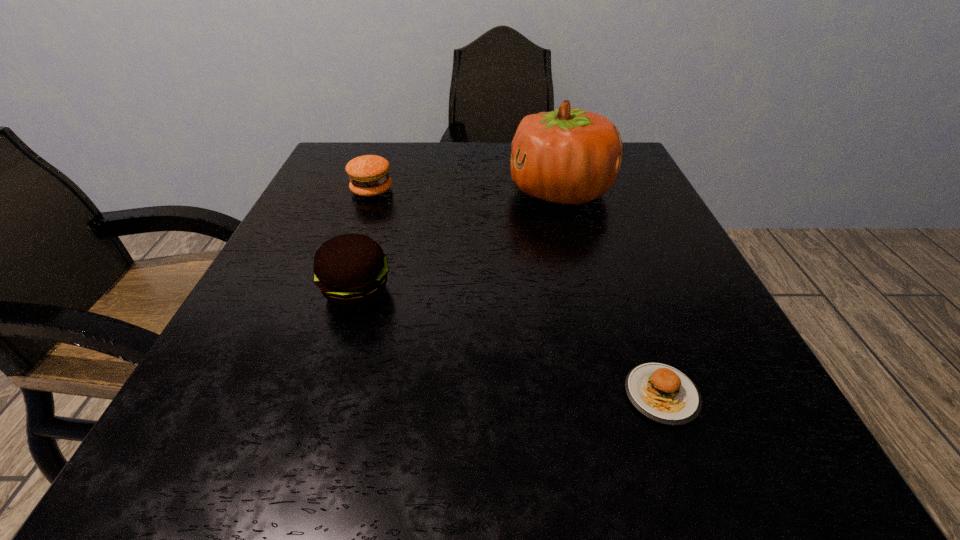
Identify the location of free point that satisfies the following two spatial constraints: 1. on the side of the tallest object with the cute face; 2. on the left side of the nearest food. The height and width of the screenshot is (540, 960). (614, 395).

You are a GUI agent. You are given a task and a screenshot of the screen. Output one action in this format:
    pyautogui.click(x=<x>, y=<y>)
    Task: Click on the vacant area that satisfies the following two spatial constraints: 1. on the side of the pumpkin with the cute face; 2. on the front side of the second tallest object
    Image resolution: width=960 pixels, height=540 pixels.
    Given the screenshot: What is the action you would take?
    (x=587, y=291)

Locate an element on the screen. The image size is (960, 540). free space that satisfies the following two spatial constraints: 1. on the side of the nearest object with the cute face; 2. on the right side of the pumpkin is located at coordinates (614, 395).

At what (x,y) coordinates should I click in order to perform the action: click on vacant space that satisfies the following two spatial constraints: 1. on the back side of the nearest object; 2. on the side of the pumpkin with the cute face. Please return your answer as a coordinate pair (x, y). The width and height of the screenshot is (960, 540). Looking at the image, I should click on (588, 192).